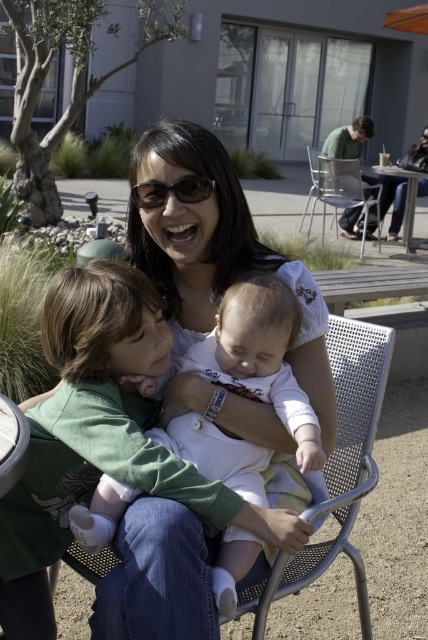
Question: Which point appears farthest from the camera in this image?

Choices:
 (A) coord(321,163)
 (B) coord(299,449)

Answer: (A)

Question: Does metallic silver chair at upper center have a lesser width compared to matte black sunglasses at center?

Choices:
 (A) yes
 (B) no

Answer: (B)

Question: In this image, where is white matte baby at center located relative to metallic silver chair at upper center?

Choices:
 (A) right
 (B) left

Answer: (B)

Question: Which point appears closest to the camera in this image?

Choices:
 (A) (146, 180)
 (B) (359, 180)
 (C) (214, 429)

Answer: (C)

Question: Can you confirm if white matte baby at center is smaller than matte black sunglasses at center?

Choices:
 (A) no
 (B) yes

Answer: (A)

Question: Which point is farther to the camera?

Choices:
 (A) (333, 211)
 (B) (204, 184)
 (C) (262, 326)

Answer: (A)